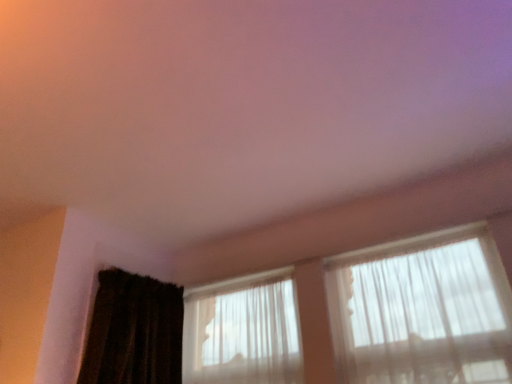
Find the location of a particular element. This screenshot has width=512, height=384. translucent fabric at upper right, positioned as the 1th window in right-to-left order is located at coordinates (422, 311).

You are a GUI agent. You are given a task and a screenshot of the screen. Output one action in this format:
    pyautogui.click(x=<x>, y=<y>)
    Task: Click on the translucent fabric at upper right, which ranks as the second window in left-to-right order
    
    Given the screenshot: What is the action you would take?
    pyautogui.click(x=422, y=311)

Which object is wider, translucent fabric window at center, which is the first window from left to right, or translucent fabric at upper right, which ranks as the second window in left-to-right order?

With larger width is translucent fabric at upper right, which ranks as the second window in left-to-right order.

In terms of size, does translucent fabric window at center, the second window positioned from the right, appear bigger or smaller than translucent fabric at upper right, which ranks as the second window in left-to-right order?

Considering their sizes, translucent fabric window at center, the second window positioned from the right, takes up less space than translucent fabric at upper right, which ranks as the second window in left-to-right order.

Where is `window that is behind the translucent fabric at upper right, positioned as the 1th window in right-to-left order`? The height and width of the screenshot is (384, 512). window that is behind the translucent fabric at upper right, positioned as the 1th window in right-to-left order is located at coordinates (242, 331).

Is dark brown textured curtain at lower left bigger or smaller than translucent fabric window at center, which is the first window from left to right?

dark brown textured curtain at lower left is bigger than translucent fabric window at center, which is the first window from left to right.

From a real-world perspective, is dark brown textured curtain at lower left physically above translucent fabric window at center, the second window positioned from the right?

Yes, from a real-world perspective, dark brown textured curtain at lower left is above translucent fabric window at center, the second window positioned from the right.

Find the location of `curtain above the translucent fabric window at center, which is the first window from left to right (from a real-world perspective)`. curtain above the translucent fabric window at center, which is the first window from left to right (from a real-world perspective) is located at coordinates (134, 331).

Between point (205, 332) and point (146, 364), which one is positioned behind?

Point (205, 332)

Relative to dark brown textured curtain at lower left, is translucent fabric window at center, the second window positioned from the right, in front or behind?

translucent fabric window at center, the second window positioned from the right, is positioned farther from the viewer than dark brown textured curtain at lower left.

Between translucent fabric window at center, which is the first window from left to right, and dark brown textured curtain at lower left, which one appears on the left side from the viewer's perspective?

dark brown textured curtain at lower left.

From a real-world perspective, between translucent fabric window at center, which is the first window from left to right, and dark brown textured curtain at lower left, who is vertically higher?

In real-world perspective, dark brown textured curtain at lower left is above.

Which object is closer to the camera, dark brown textured curtain at lower left or translucent fabric at upper right, which ranks as the second window in left-to-right order?

translucent fabric at upper right, which ranks as the second window in left-to-right order, is closer to the camera.

Considering the points (141, 378) and (353, 298), which point is in front, point (141, 378) or point (353, 298)?

The point (353, 298) is in front.

Considering the sizes of objects translucent fabric at upper right, which ranks as the second window in left-to-right order, and translucent fabric window at center, which is the first window from left to right, in the image provided, who is bigger, translucent fabric at upper right, which ranks as the second window in left-to-right order, or translucent fabric window at center, which is the first window from left to right,?

translucent fabric at upper right, which ranks as the second window in left-to-right order.

Locate an element on the screen. window below the translucent fabric at upper right, positioned as the 1th window in right-to-left order (from the image's perspective) is located at coordinates (242, 331).

From the image's perspective, is translucent fabric at upper right, which ranks as the second window in left-to-right order, above or below dark brown textured curtain at lower left?

Based on their image positions, translucent fabric at upper right, which ranks as the second window in left-to-right order, is located above dark brown textured curtain at lower left.

Which is in front, point (349, 359) or point (139, 307)?

Point (349, 359)

From a real-world perspective, which object stands above the other?

In real-world perspective, dark brown textured curtain at lower left is above.

Does translucent fabric at upper right, positioned as the 1th window in right-to-left order, have a greater height compared to dark brown textured curtain at lower left?

Yes, translucent fabric at upper right, positioned as the 1th window in right-to-left order, is taller than dark brown textured curtain at lower left.

The height and width of the screenshot is (384, 512). Identify the location of window that appears on the right of translucent fabric window at center, the second window positioned from the right. (422, 311).

Where is `window below the dark brown textured curtain at lower left (from the image's perspective)`? Image resolution: width=512 pixels, height=384 pixels. window below the dark brown textured curtain at lower left (from the image's perspective) is located at coordinates (242, 331).

Based on their spatial positions, is translucent fabric at upper right, which ranks as the second window in left-to-right order, or translucent fabric window at center, which is the first window from left to right, closer to dark brown textured curtain at lower left?

translucent fabric window at center, which is the first window from left to right.

Looking at the image, which one is located closer to dark brown textured curtain at lower left, translucent fabric window at center, which is the first window from left to right, or translucent fabric at upper right, which ranks as the second window in left-to-right order?

Based on the image, translucent fabric window at center, which is the first window from left to right, appears to be nearer to dark brown textured curtain at lower left.

Which object lies further to the anchor point translucent fabric window at center, which is the first window from left to right, translucent fabric at upper right, positioned as the 1th window in right-to-left order, or dark brown textured curtain at lower left?

The object further to translucent fabric window at center, which is the first window from left to right, is translucent fabric at upper right, positioned as the 1th window in right-to-left order.

Which object lies nearer to the anchor point translucent fabric window at center, which is the first window from left to right, dark brown textured curtain at lower left or translucent fabric at upper right, which ranks as the second window in left-to-right order?

The object closer to translucent fabric window at center, which is the first window from left to right, is dark brown textured curtain at lower left.

Based on their spatial positions, is dark brown textured curtain at lower left or translucent fabric window at center, the second window positioned from the right, closer to translucent fabric at upper right, which ranks as the second window in left-to-right order?

translucent fabric window at center, the second window positioned from the right.

Considering their positions, is translucent fabric window at center, the second window positioned from the right, positioned further to translucent fabric at upper right, positioned as the 1th window in right-to-left order, than dark brown textured curtain at lower left?

dark brown textured curtain at lower left lies further to translucent fabric at upper right, positioned as the 1th window in right-to-left order, than the other object.

At what (x,y) coordinates should I click in order to perform the action: click on window located between dark brown textured curtain at lower left and translucent fabric at upper right, positioned as the 1th window in right-to-left order, in the left-right direction. Please return your answer as a coordinate pair (x, y). Looking at the image, I should click on (242, 331).